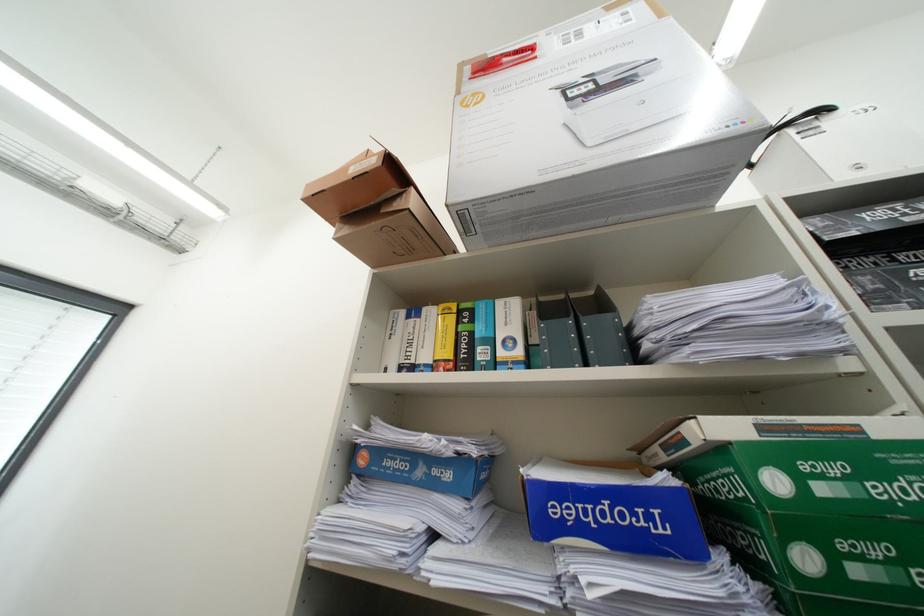
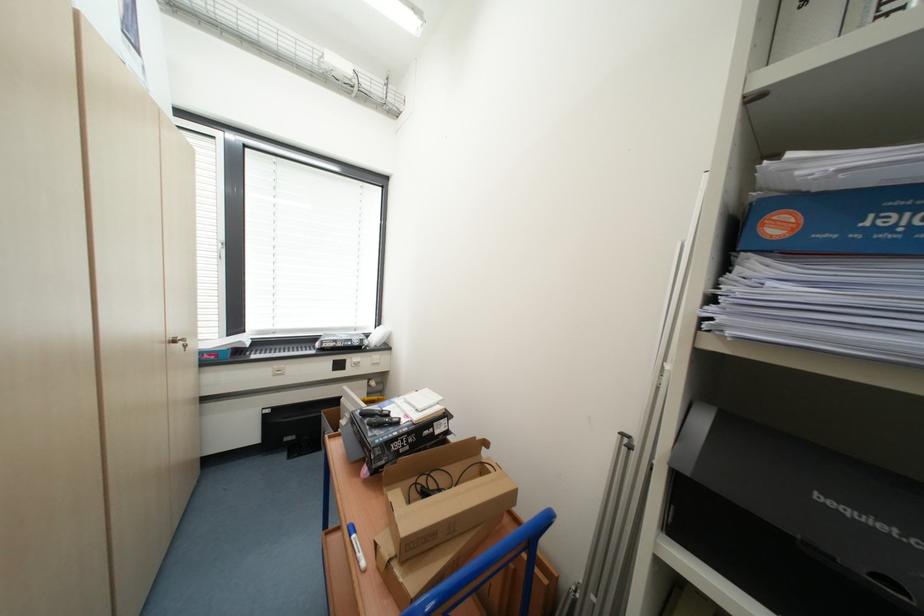
Based on the continuous images, in which direction is the camera rotating?

The rotation direction of the camera is left-down.